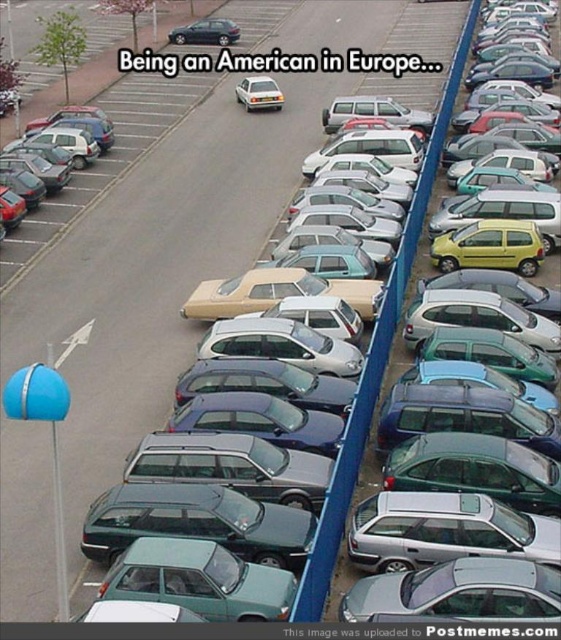
You are a delivery person trying to park your truck in this European parking lot. You see a matte beige car at left and a shiny metallic sedan at center. Which vehicle should you avoid if you need to park in a spot that can only accommodate smaller cars?

You should avoid the matte beige car at left because it is larger than the shiny metallic sedan at center, meaning the sedan would fit better in smaller parking spots.

You are a tourist in Europe and you see a matte beige car at left and a shiny metallic sedan at center in a parking lot. Which car is closer to the entrance of the parking lot?

The matte beige car at left is closer to the entrance of the parking lot because it is positioned to the left of the shiny metallic sedan at center, and in many European parking layouts, the entrance is often on the left side.